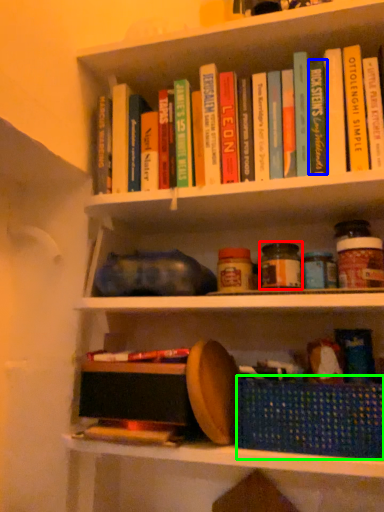
Question: Considering the real-world distances, which object is farthest from glass jar (highlighted by a red box)? paperback book (highlighted by a blue box) or basket (highlighted by a green box)?

Choices:
 (A) paperback book
 (B) basket

Answer: (B)